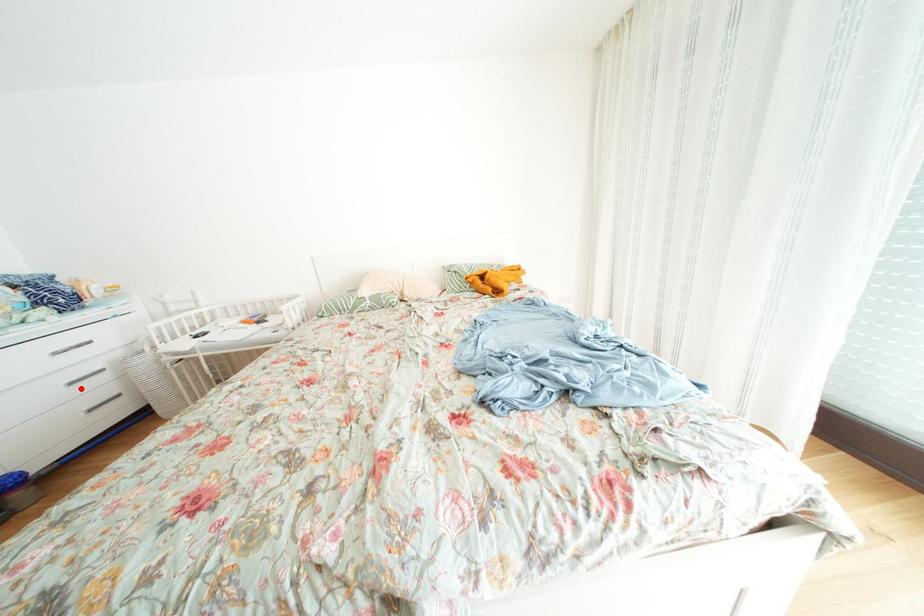
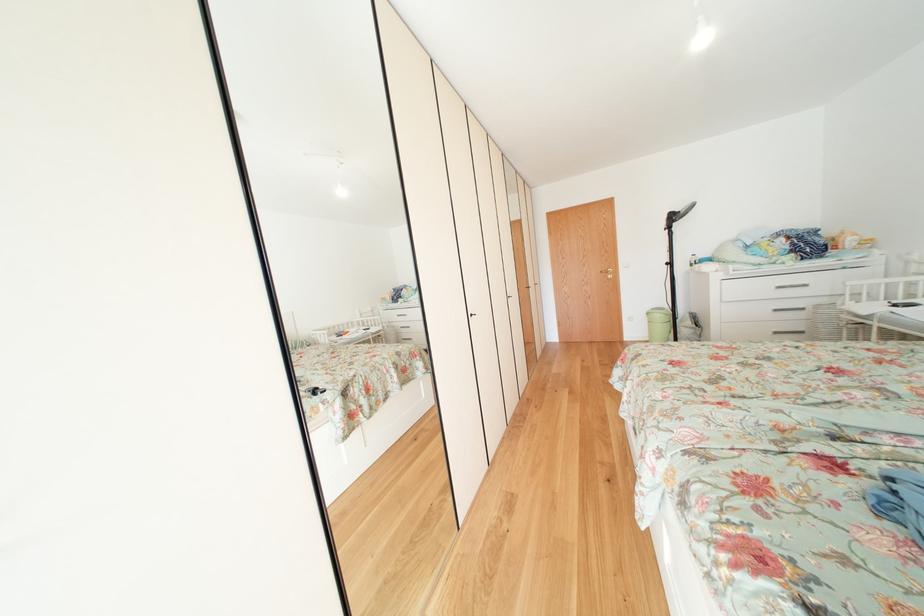
Find the pixel in the second image that matches the highlighted location in the first image.

(784, 315)